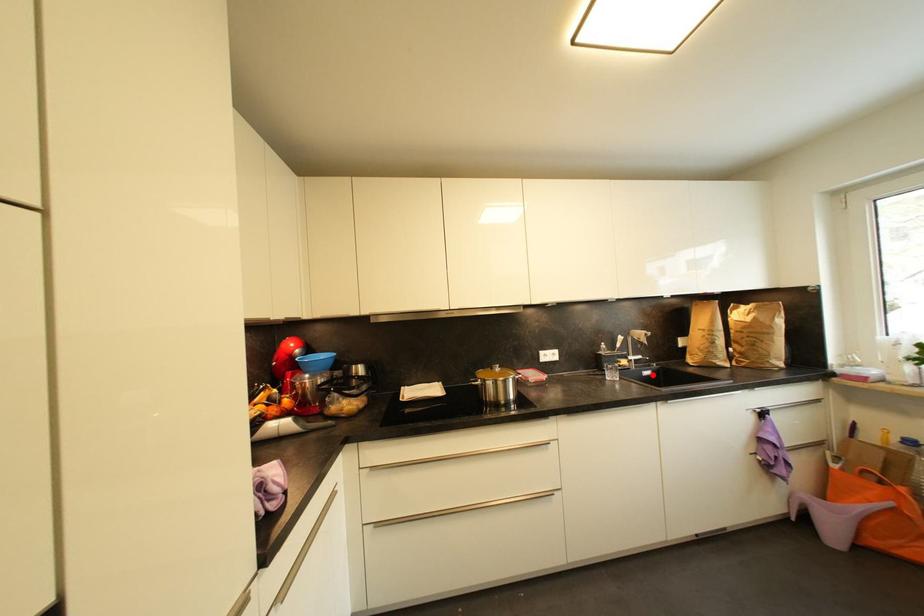
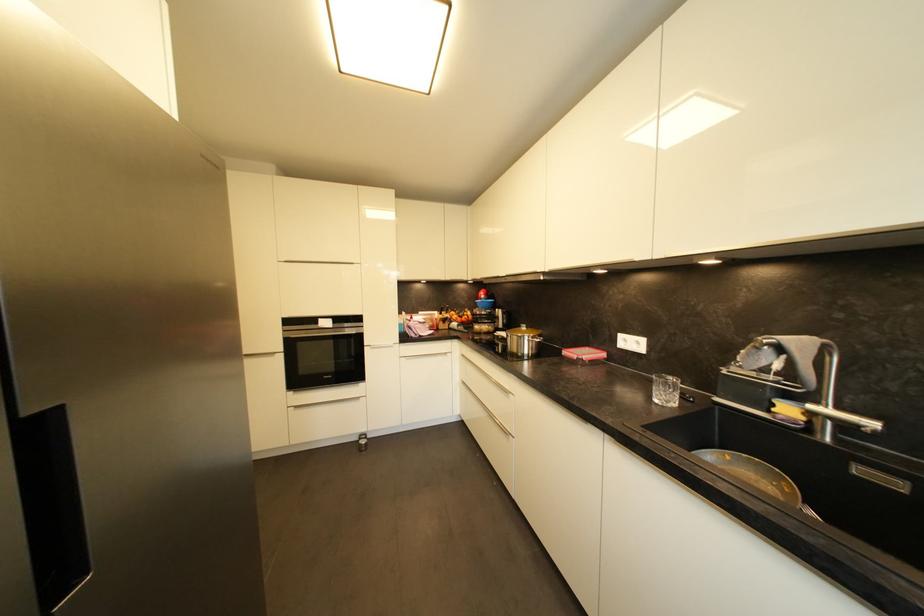
Find the pixel in the second image that matches the highlighted location in the first image.

(904, 487)